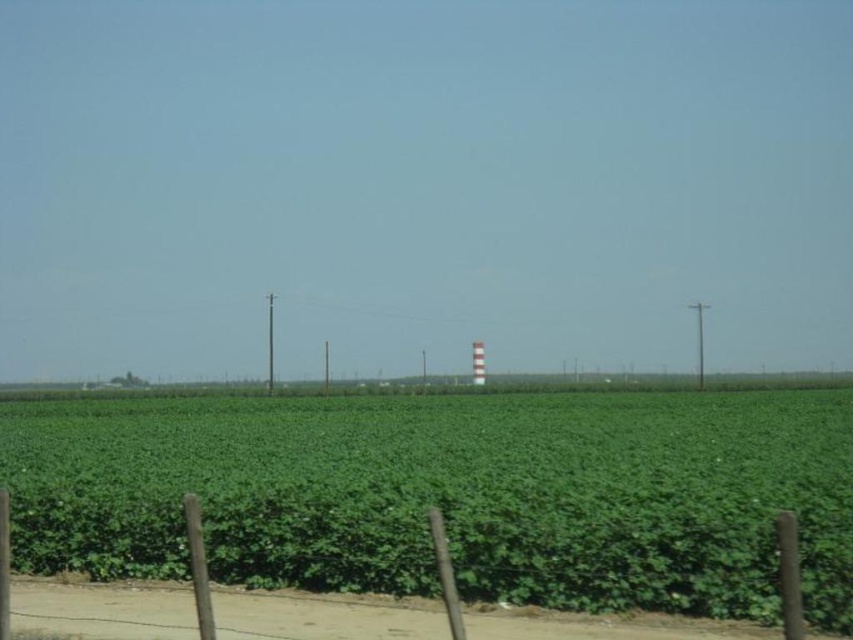
Can you confirm if green leafy field at center is positioned to the right of smooth wood pole at center?

Indeed, green leafy field at center is positioned on the right side of smooth wood pole at center.

Which is behind, point (744, 476) or point (270, 342)?

Positioned behind is point (270, 342).

You are a GUI agent. You are given a task and a screenshot of the screen. Output one action in this format:
    pyautogui.click(x=<x>, y=<y>)
    Task: Click on the green leafy field at center
    
    Given the screenshot: What is the action you would take?
    pyautogui.click(x=450, y=493)